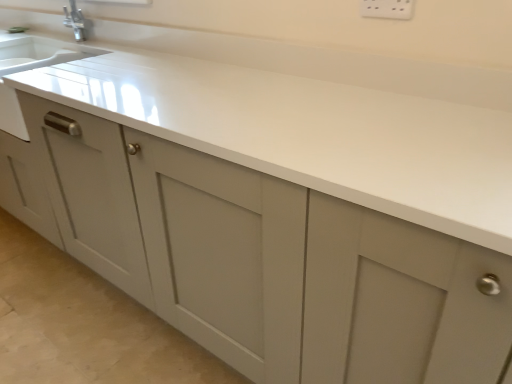
Question: In terms of size, does white plastic electric outlet at upper center appear bigger or smaller than white matte countertop at center?

Choices:
 (A) big
 (B) small

Answer: (B)

Question: Is white plastic electric outlet at upper center wider or thinner than white matte countertop at center?

Choices:
 (A) thin
 (B) wide

Answer: (A)

Question: From a real-world perspective, is white plastic electric outlet at upper center physically located above or below white matte countertop at center?

Choices:
 (A) above
 (B) below

Answer: (A)

Question: In terms of size, does white matte countertop at center appear bigger or smaller than white plastic electric outlet at upper center?

Choices:
 (A) small
 (B) big

Answer: (B)

Question: From the image's perspective, is white matte countertop at center above or below white plastic electric outlet at upper center?

Choices:
 (A) above
 (B) below

Answer: (B)

Question: From a real-world perspective, is white matte countertop at center positioned above or below white plastic electric outlet at upper center?

Choices:
 (A) below
 (B) above

Answer: (A)

Question: Is white matte countertop at center taller or shorter than white plastic electric outlet at upper center?

Choices:
 (A) tall
 (B) short

Answer: (A)